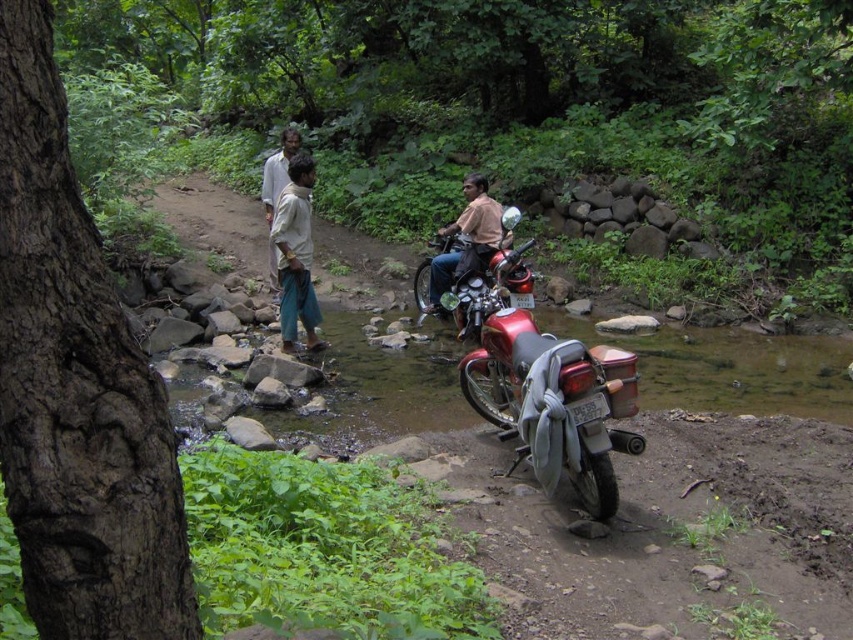
Is shiny metallic motorcycle at center thinner than brown leather jacket at center?

Indeed, shiny metallic motorcycle at center has a lesser width compared to brown leather jacket at center.

Which is behind, point (607, 492) or point (461, 269)?

Point (461, 269)

Does point (521, 321) lie behind point (461, 216)?

No, it is in front of (461, 216).

The height and width of the screenshot is (640, 853). In order to click on shiny metallic motorcycle at center in this screenshot , I will do `click(543, 380)`.

Is light beige fabric pants at center bigger than brown leather jacket at center?

Incorrect, light beige fabric pants at center is not larger than brown leather jacket at center.

Is light beige fabric pants at center behind brown leather jacket at center?

No.

Is point (281, 236) positioned behind point (498, 227)?

No, (281, 236) is in front of (498, 227).

Where is `light beige fabric pants at center`? light beige fabric pants at center is located at coordinates (294, 253).

Is shiny metallic motorcycle at center to the left of light beige fabric pants at center from the viewer's perspective?

In fact, shiny metallic motorcycle at center is to the right of light beige fabric pants at center.

Image resolution: width=853 pixels, height=640 pixels. Describe the element at coordinates (543, 380) in the screenshot. I see `shiny metallic motorcycle at center` at that location.

This screenshot has height=640, width=853. What are the coordinates of `shiny metallic motorcycle at center` in the screenshot? It's located at (543, 380).